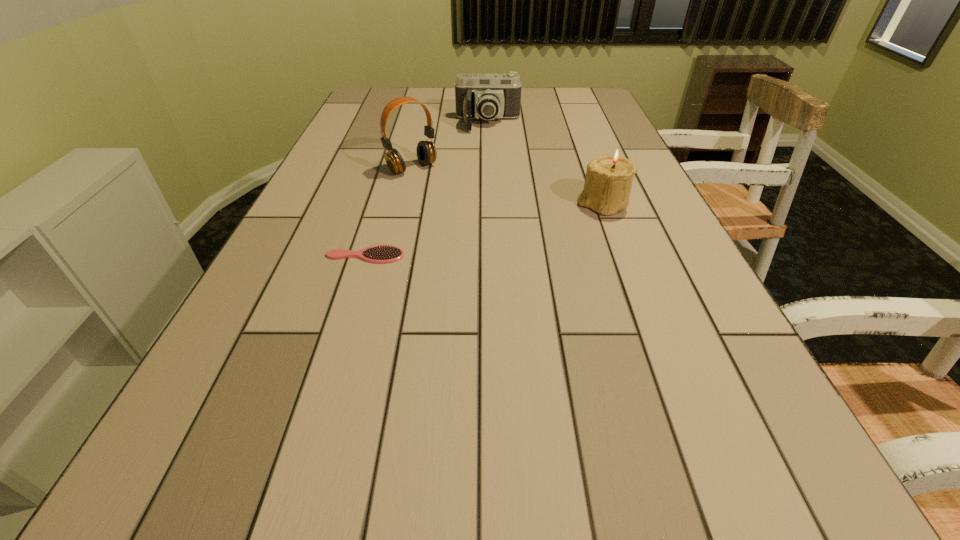
At what (x,y) coordinates should I click in order to perform the action: click on hairbrush. Please return your answer as a coordinate pair (x, y). Image resolution: width=960 pixels, height=540 pixels. Looking at the image, I should click on (377, 254).

Locate an element on the screen. Image resolution: width=960 pixels, height=540 pixels. the nearest object is located at coordinates (377, 254).

At what (x,y) coordinates should I click in order to perform the action: click on the third farthest object. Please return your answer as a coordinate pair (x, y). Image resolution: width=960 pixels, height=540 pixels. Looking at the image, I should click on (x=608, y=181).

What are the coordinates of `candle_holder` in the screenshot? It's located at (608, 181).

You are a GUI agent. You are given a task and a screenshot of the screen. Output one action in this format:
    pyautogui.click(x=<x>, y=<y>)
    Task: Click on the second farthest object
    
    Given the screenshot: What is the action you would take?
    pyautogui.click(x=426, y=151)

I want to click on the tallest object, so click(x=426, y=151).

Find the location of a particular element. The image size is (960, 540). the farthest object is located at coordinates pos(488,96).

Where is `camera`? camera is located at coordinates (488, 96).

In order to click on free space located on the right of the nearest object in this screenshot , I will do `click(525, 255)`.

The image size is (960, 540). What are the coordinates of `vacant area located 0.300m on the left of the second nearest object` in the screenshot? It's located at (457, 204).